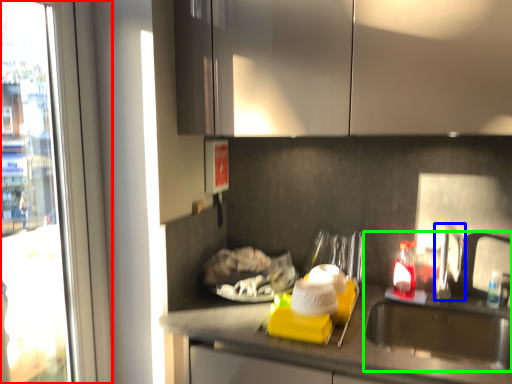
Question: Which is nearer to the window (highlighted by a red box)? faucet (highlighted by a blue box) or sink (highlighted by a green box).

Choices:
 (A) faucet
 (B) sink

Answer: (B)